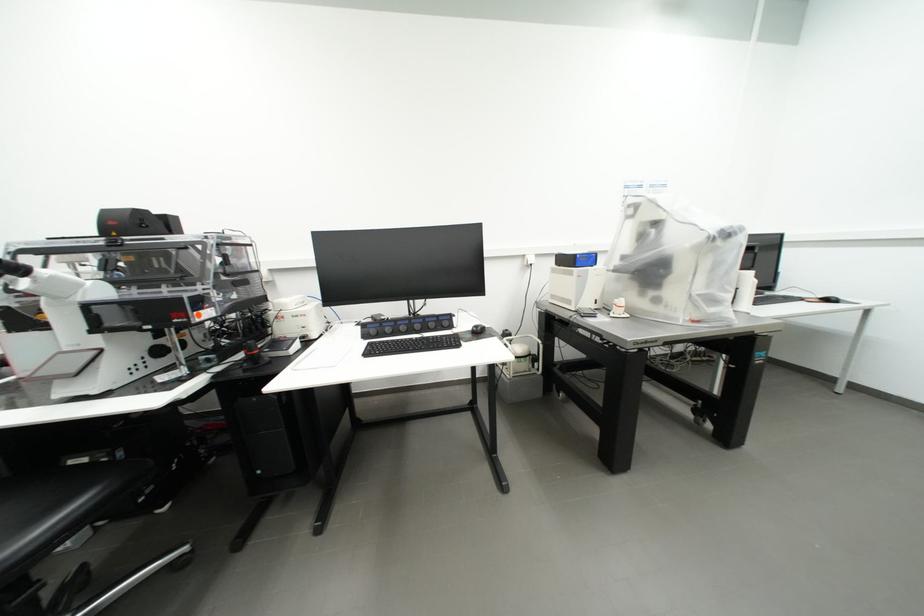
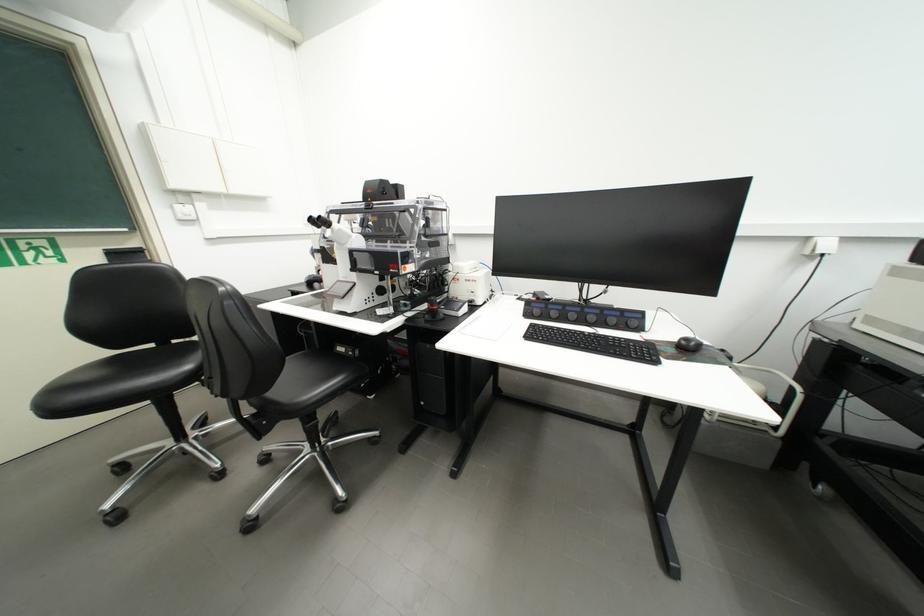
Locate, in the second image, the point that corresponds to point (487, 334) in the first image.

(697, 351)